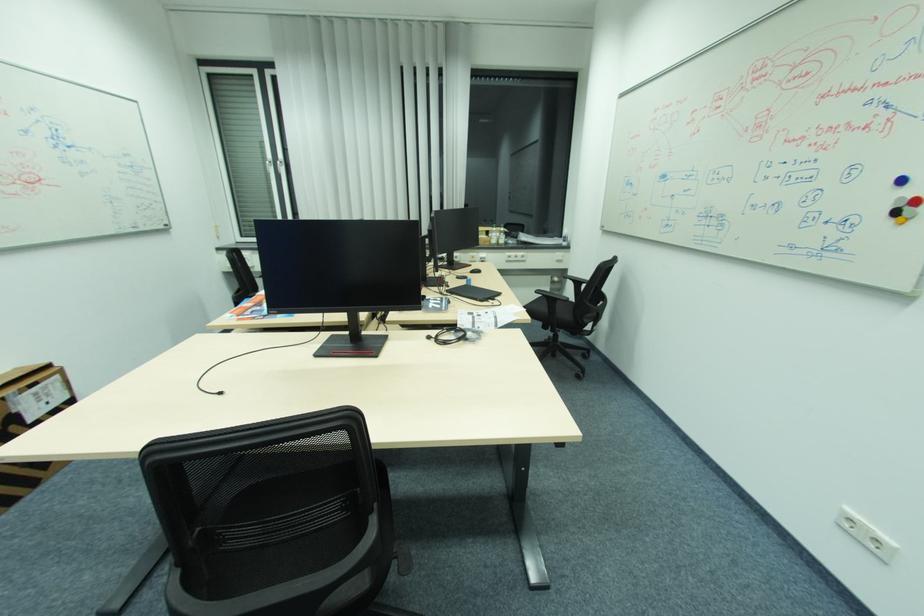
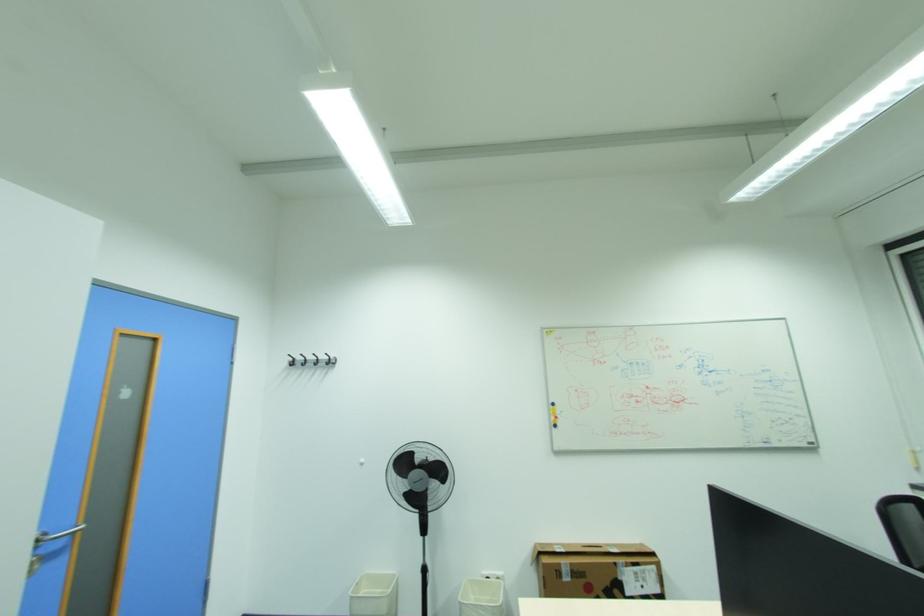
Question: Based on the continuous images, in which direction is the camera rotating? Reply with the corresponding letter.

Choices:
 (A) Left
 (B) Right
 (C) Up
 (D) Down

Answer: (A)